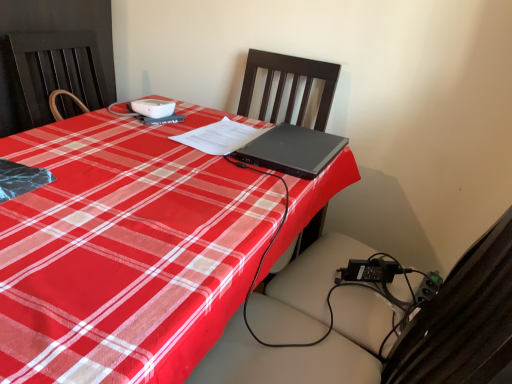
Find the location of a particular element. free space above black matte laptop at center (from a real-world perspective) is located at coordinates [301, 140].